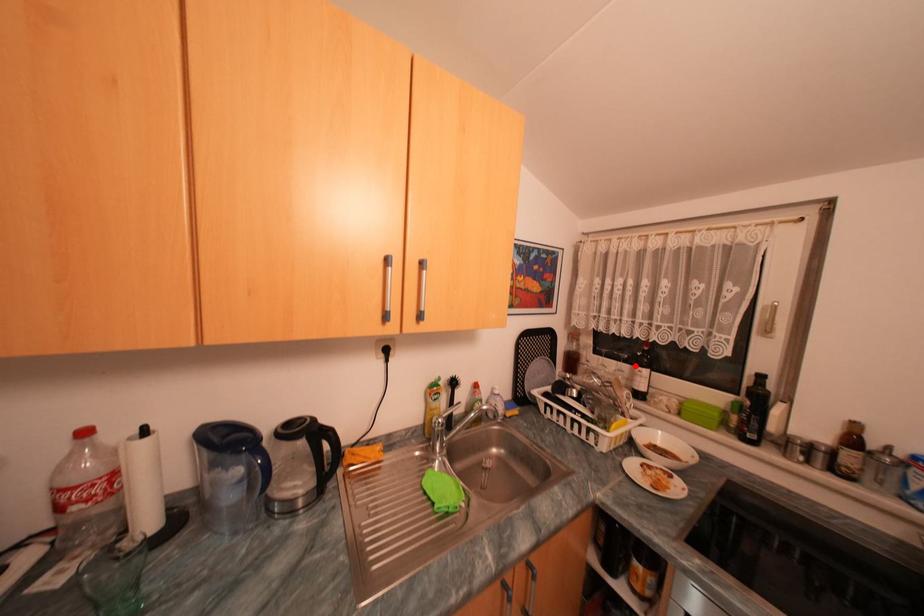
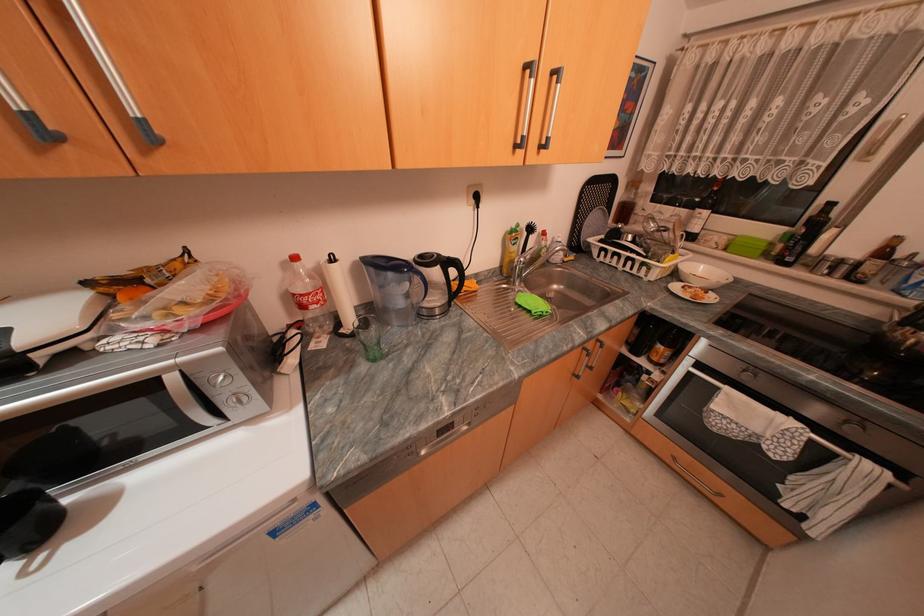
Where in the second image is the point corresponding to the highlighted location from the first image?

(694, 209)